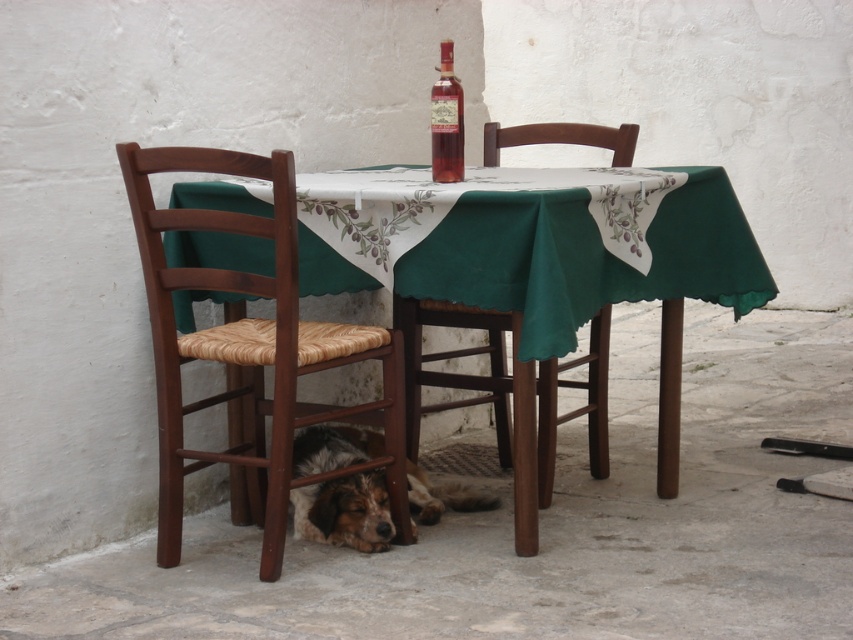
Does point (157, 276) come behind point (442, 118)?

No, (157, 276) is in front of (442, 118).

Which is in front, point (245, 403) or point (440, 93)?

Point (440, 93) is more forward.

Where is `brown woven wood chair at lower left`? The width and height of the screenshot is (853, 640). brown woven wood chair at lower left is located at coordinates (248, 353).

Can you confirm if green fabric table at center is taller than matte glass bottle at center?

Yes.

Is green fabric table at center smaller than matte glass bottle at center?

No.

Where is `green fabric table at center`? green fabric table at center is located at coordinates (584, 257).

Find the location of `green fabric table at center`. green fabric table at center is located at coordinates (584, 257).

Can you confirm if brown fur dog at lower center is positioned below matte glass bottle at center?

Yes.

Does brown fur dog at lower center have a larger size compared to matte glass bottle at center?

Yes.

Is point (334, 492) farther from viewer compared to point (448, 42)?

That is True.

Identify the location of brown fur dog at lower center. (345, 512).